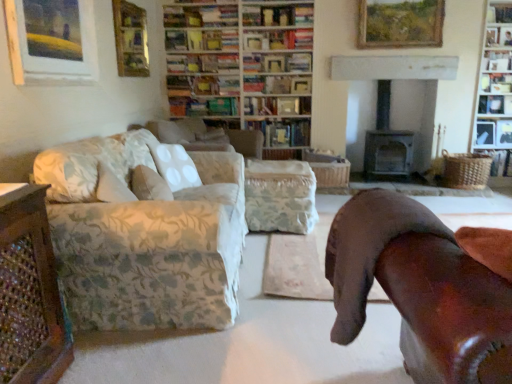
Question: Should I look upward or downward to see white wooden bookcase at upper right, arranged as the first bookcase when viewed from the right?

Choices:
 (A) up
 (B) down

Answer: (A)

Question: Considering the relative positions of woven brown basket at right, acting as the fifth book starting from the left, and wooden picture frame at upper center, the third picture frame positioned from the front, in the image provided, is woven brown basket at right, acting as the fifth book starting from the left, to the left of wooden picture frame at upper center, the third picture frame positioned from the front, from the viewer's perspective?

Choices:
 (A) no
 (B) yes

Answer: (A)

Question: From a real-world perspective, is woven brown basket at right, the first book from the right, positioned under wooden picture frame at upper center, marked as the 2th picture frame in a back-to-front arrangement, based on gravity?

Choices:
 (A) no
 (B) yes

Answer: (B)

Question: Does woven brown basket at right, acting as the fifth book starting from the left, lie in front of wooden picture frame at upper center, the third picture frame positioned from the front?

Choices:
 (A) yes
 (B) no

Answer: (B)

Question: Is woven brown basket at right, acting as the fifth book starting from the left, taller than wooden picture frame at upper center, which is counted as the third picture frame, starting from the left?

Choices:
 (A) no
 (B) yes

Answer: (A)

Question: From the image's perspective, is woven brown basket at right, acting as the fifth book starting from the left, over wooden picture frame at upper center, marked as the 2th picture frame in a back-to-front arrangement?

Choices:
 (A) yes
 (B) no

Answer: (B)

Question: Is woven brown basket at right, acting as the fifth book starting from the left, oriented towards wooden picture frame at upper center, marked as the 2th picture frame in a back-to-front arrangement?

Choices:
 (A) yes
 (B) no

Answer: (B)

Question: Does wooden bookshelf at upper right, arranged as the first shelf when viewed from the top, have a larger size compared to brown leather chair at right?

Choices:
 (A) yes
 (B) no

Answer: (B)

Question: From the image's perspective, is wooden bookshelf at upper right, which appears as the 3th shelf when ordered from the bottom, under brown leather chair at right?

Choices:
 (A) no
 (B) yes

Answer: (A)

Question: Considering the relative sizes of wooden bookshelf at upper right, arranged as the first shelf when viewed from the top, and brown leather chair at right in the image provided, is wooden bookshelf at upper right, arranged as the first shelf when viewed from the top, shorter than brown leather chair at right?

Choices:
 (A) yes
 (B) no

Answer: (A)

Question: Can you confirm if wooden bookshelf at upper right, which appears as the 3th shelf when ordered from the bottom, is positioned to the left of brown leather chair at right?

Choices:
 (A) no
 (B) yes

Answer: (A)

Question: Is the surface of wooden bookshelf at upper right, arranged as the first shelf when viewed from the top, in direct contact with brown leather chair at right?

Choices:
 (A) no
 (B) yes

Answer: (A)

Question: From a real-world perspective, is wooden bookshelf at upper right, arranged as the first shelf when viewed from the top, on top of brown leather chair at right?

Choices:
 (A) no
 (B) yes

Answer: (B)

Question: Does brown leather chair at right appear on the right side of wooden picture frame at upper left, acting as the first picture frame starting from the left?

Choices:
 (A) no
 (B) yes

Answer: (B)